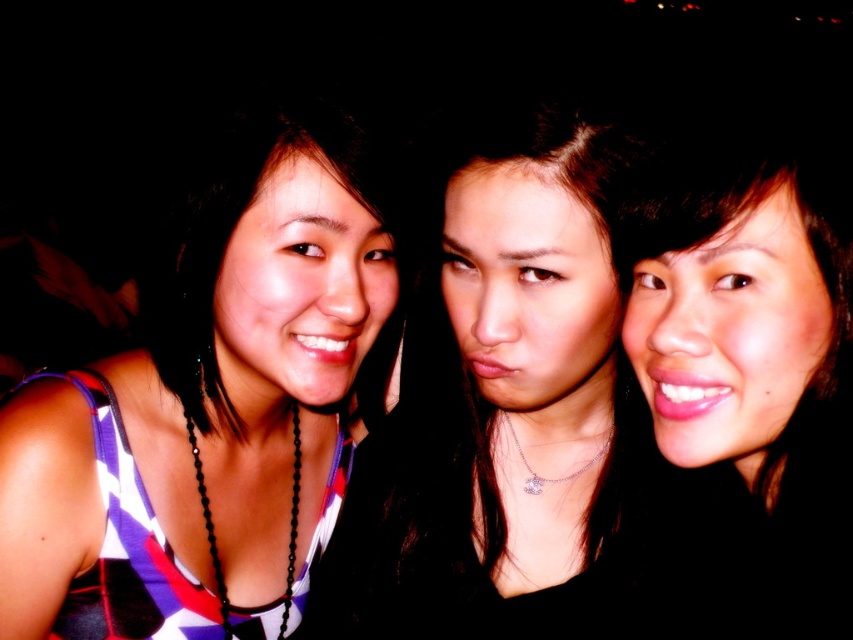
Question: Can you confirm if smooth black hair at center is wider than smooth skin at center?

Choices:
 (A) yes
 (B) no

Answer: (A)

Question: Which object is positioned farthest from the smooth black hair at center?

Choices:
 (A) striped fabric dress at left
 (B) smooth skin at center

Answer: (A)

Question: Does striped fabric dress at left appear under smooth skin at center?

Choices:
 (A) no
 (B) yes

Answer: (A)

Question: Which of these objects is positioned closest to the smooth skin at center?

Choices:
 (A) smooth black hair at center
 (B) striped fabric dress at left

Answer: (A)

Question: Which object is closer to the camera taking this photo?

Choices:
 (A) striped fabric dress at left
 (B) smooth black hair at center
 (C) smooth skin at center

Answer: (C)

Question: Observing the image, what is the correct spatial positioning of smooth black hair at center in reference to smooth skin at center?

Choices:
 (A) right
 (B) left

Answer: (B)